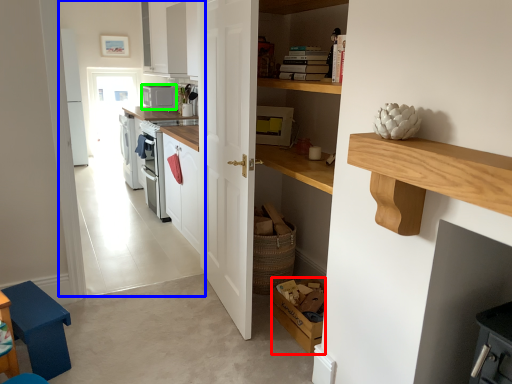
Question: Which is nearer to the box (highlighted by a red box)? corridor (highlighted by a blue box) or appliance (highlighted by a green box).

Choices:
 (A) corridor
 (B) appliance

Answer: (B)